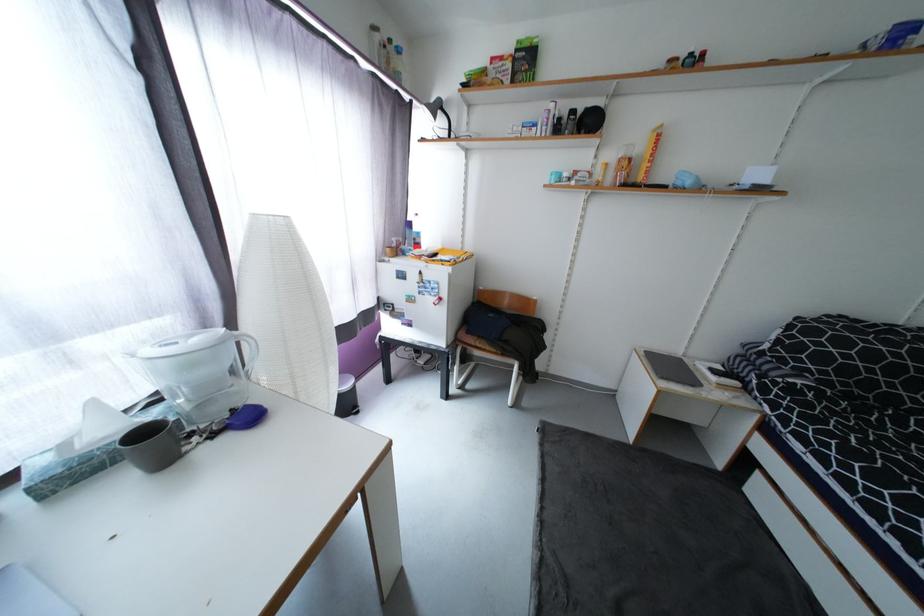
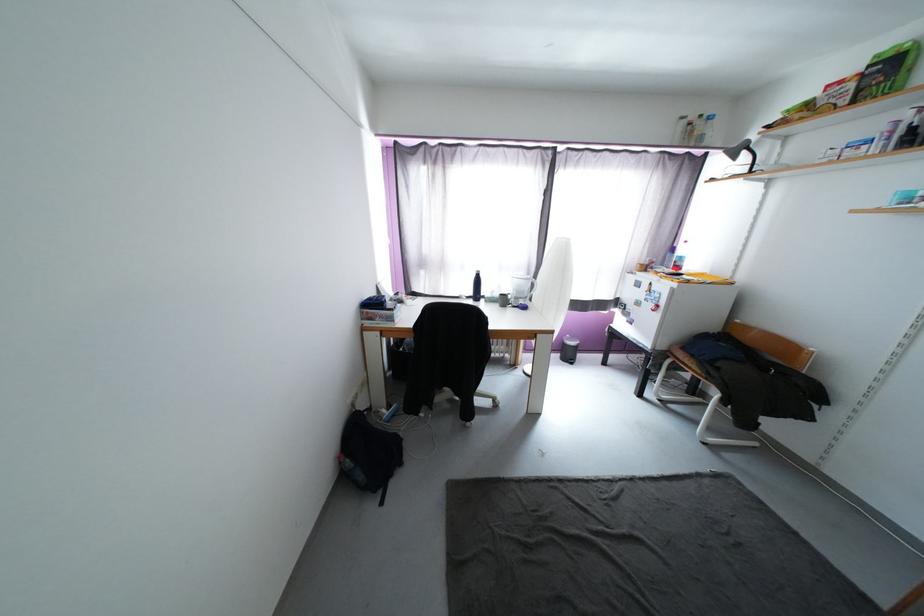
The point at (550,347) is marked in the first image. Where is the corresponding point in the second image?

(812, 419)